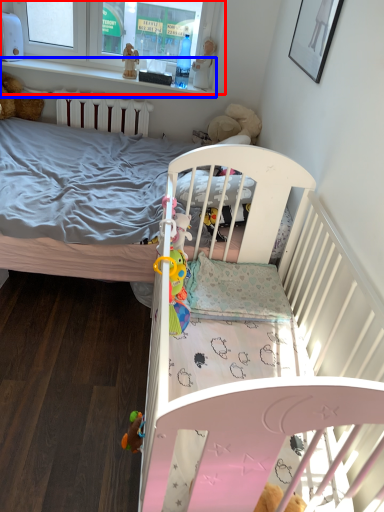
Question: Among these objects, which one is nearest to the camera, window frame (highlighted by a red box) or balustrade (highlighted by a blue box)?

Choices:
 (A) window frame
 (B) balustrade

Answer: (A)